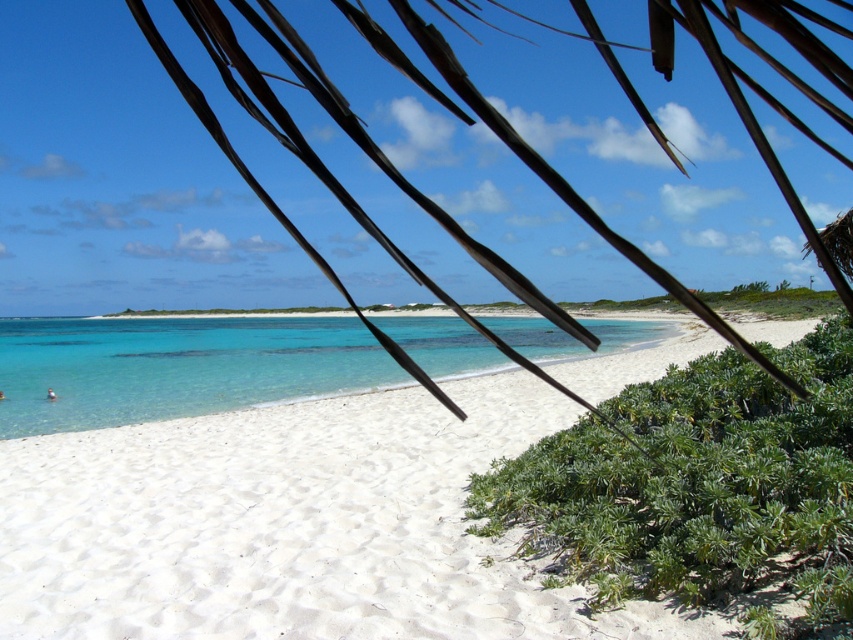
Is white sand beach at center thinner than clear blue water at center?

Correct, white sand beach at center's width is less than clear blue water at center's.

Does white sand beach at center lie in front of clear blue water at center?

Yes, white sand beach at center is closer to the viewer.

Does point (10, 461) come closer to viewer compared to point (134, 387)?

That is True.

Find the location of a particular element. This screenshot has width=853, height=640. white sand beach at center is located at coordinates (289, 525).

Can you confirm if white sand beach at center is wider than green leafy bush at lower right?

Yes, white sand beach at center is wider than green leafy bush at lower right.

Describe the element at coordinates (289, 525) in the screenshot. I see `white sand beach at center` at that location.

Is point (341, 442) positioned behind point (589, 436)?

Yes.

Where is `white sand beach at center`? The height and width of the screenshot is (640, 853). white sand beach at center is located at coordinates (289, 525).

Looking at this image, does green leafy bush at lower right have a greater width compared to clear blue water at center?

In fact, green leafy bush at lower right might be narrower than clear blue water at center.

Which is more to the right, green leafy bush at lower right or clear blue water at center?

From the viewer's perspective, green leafy bush at lower right appears more on the right side.

The height and width of the screenshot is (640, 853). What are the coordinates of `green leafy bush at lower right` in the screenshot? It's located at (701, 488).